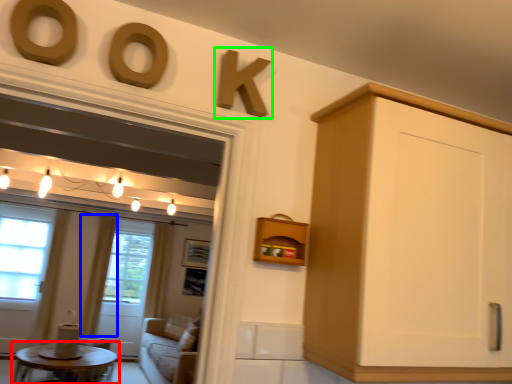
Question: Which is nearer to the coffee table (highlighted by a red box)? curtain (highlighted by a blue box) or number (highlighted by a green box).

Choices:
 (A) curtain
 (B) number

Answer: (A)